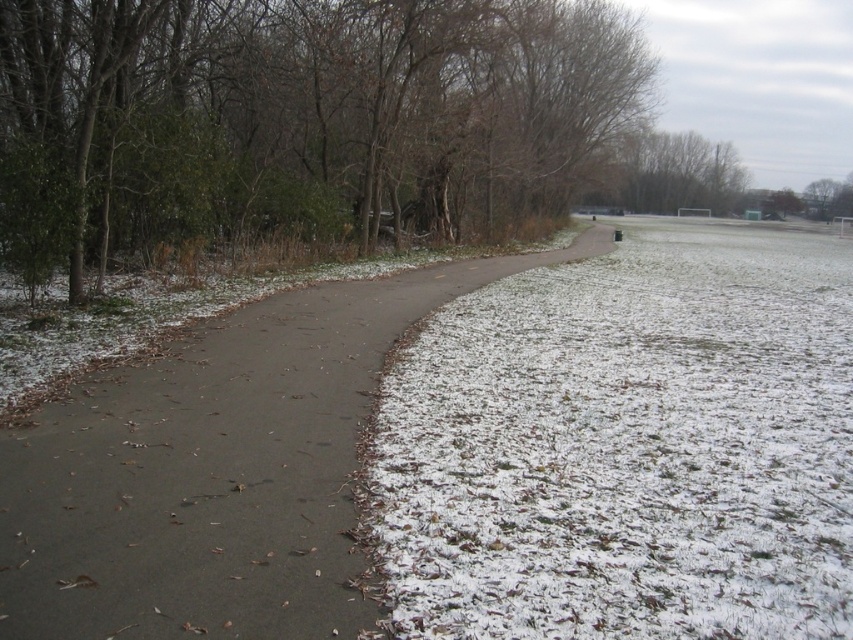
Question: Which point is farther to the camera?

Choices:
 (A) (515, 128)
 (B) (106, 419)

Answer: (A)

Question: Can you confirm if green matte tree at left is positioned above sandy brown asphalt path at center?

Choices:
 (A) yes
 (B) no

Answer: (A)

Question: Considering the relative positions of green matte tree at left and sandy brown asphalt path at center in the image provided, where is green matte tree at left located with respect to sandy brown asphalt path at center?

Choices:
 (A) above
 (B) below

Answer: (A)

Question: Which point appears farthest from the camera in this image?

Choices:
 (A) (309, 372)
 (B) (328, 99)

Answer: (B)

Question: From the image, what is the correct spatial relationship of green matte tree at left in relation to sandy brown asphalt path at center?

Choices:
 (A) right
 (B) left

Answer: (A)